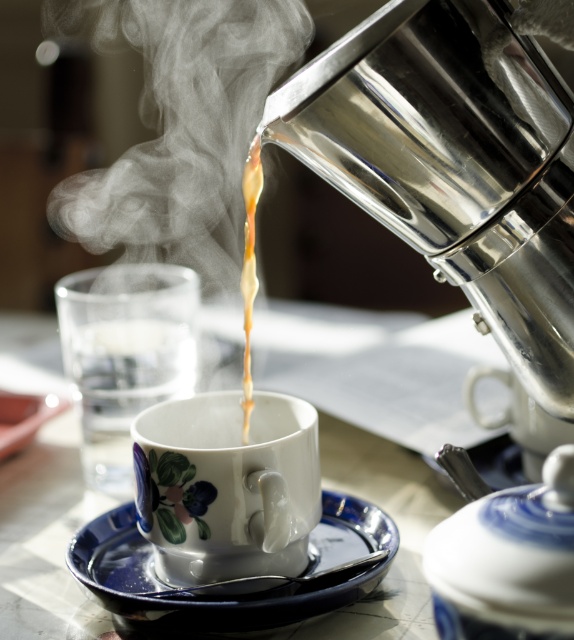
Question: Is blue glossy saucer at lower center further to camera compared to brown glossy liquid at center?

Choices:
 (A) no
 (B) yes

Answer: (B)

Question: Which object is the farthest from the porcelain floral cup at center?

Choices:
 (A) brown glossy liquid at center
 (B) blue glossy saucer at lower center

Answer: (A)

Question: Which point is closer to the camera?

Choices:
 (A) porcelain floral cup at center
 (B) blue glazed teapot at right
 (C) brown glossy liquid at center

Answer: (B)

Question: Does porcelain floral cup at center have a larger size compared to blue glossy saucer at lower center?

Choices:
 (A) yes
 (B) no

Answer: (A)

Question: Can you confirm if porcelain floral cup at center is positioned above blue glazed teapot at right?

Choices:
 (A) no
 (B) yes

Answer: (A)

Question: Which object appears farthest from the camera in this image?

Choices:
 (A) porcelain floral cup at center
 (B) blue glossy saucer at lower center

Answer: (A)